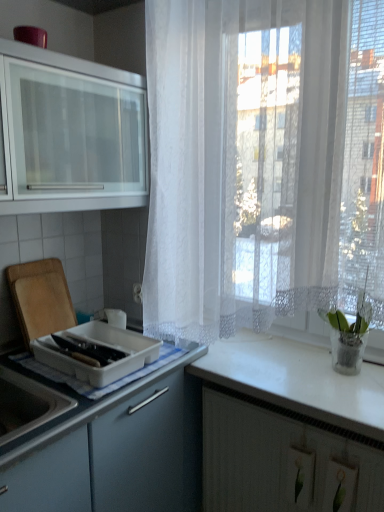
Question: Is white matte cabinet at lower right, the 1th cabinetry positioned from the right, smaller than green glass vase at right?

Choices:
 (A) no
 (B) yes

Answer: (A)

Question: Is white matte cabinet at lower right, the second cabinetry from the top, further to the viewer compared to green glass vase at right?

Choices:
 (A) no
 (B) yes

Answer: (A)

Question: Is the surface of white matte cabinet at lower right, the 1th cabinetry positioned from the right, in direct contact with green glass vase at right?

Choices:
 (A) no
 (B) yes

Answer: (A)

Question: Can you confirm if white matte cabinet at lower right, the 1th cabinetry positioned from the right, is shorter than green glass vase at right?

Choices:
 (A) yes
 (B) no

Answer: (B)

Question: Can you confirm if white matte cabinet at lower right, the 1th cabinetry positioned from the right, is taller than green glass vase at right?

Choices:
 (A) yes
 (B) no

Answer: (A)

Question: From a real-world perspective, is white lace curtain at right positioned above or below green glass vase at right?

Choices:
 (A) above
 (B) below

Answer: (A)

Question: Considering the positions of white lace curtain at right and green glass vase at right in the image, is white lace curtain at right taller or shorter than green glass vase at right?

Choices:
 (A) short
 (B) tall

Answer: (B)

Question: Is point (203, 125) closer or farther from the camera than point (352, 334)?

Choices:
 (A) closer
 (B) farther

Answer: (B)

Question: Considering the positions of white lace curtain at right and green glass vase at right in the image, is white lace curtain at right wider or thinner than green glass vase at right?

Choices:
 (A) wide
 (B) thin

Answer: (A)

Question: Considering the positions of white lace curtain at right and white plastic container at left in the image, is white lace curtain at right bigger or smaller than white plastic container at left?

Choices:
 (A) small
 (B) big

Answer: (B)

Question: Is white lace curtain at right in front of or behind white plastic container at left in the image?

Choices:
 (A) front
 (B) behind

Answer: (A)

Question: From their relative heights in the image, would you say white lace curtain at right is taller or shorter than white plastic container at left?

Choices:
 (A) short
 (B) tall

Answer: (B)

Question: Is white lace curtain at right to the left or to the right of white plastic container at left in the image?

Choices:
 (A) left
 (B) right

Answer: (B)

Question: From a real-world perspective, relative to white glossy countertop at right, is white lace curtain at right vertically above or below?

Choices:
 (A) above
 (B) below

Answer: (A)

Question: Is point (248, 48) closer or farther from the camera than point (253, 346)?

Choices:
 (A) closer
 (B) farther

Answer: (A)